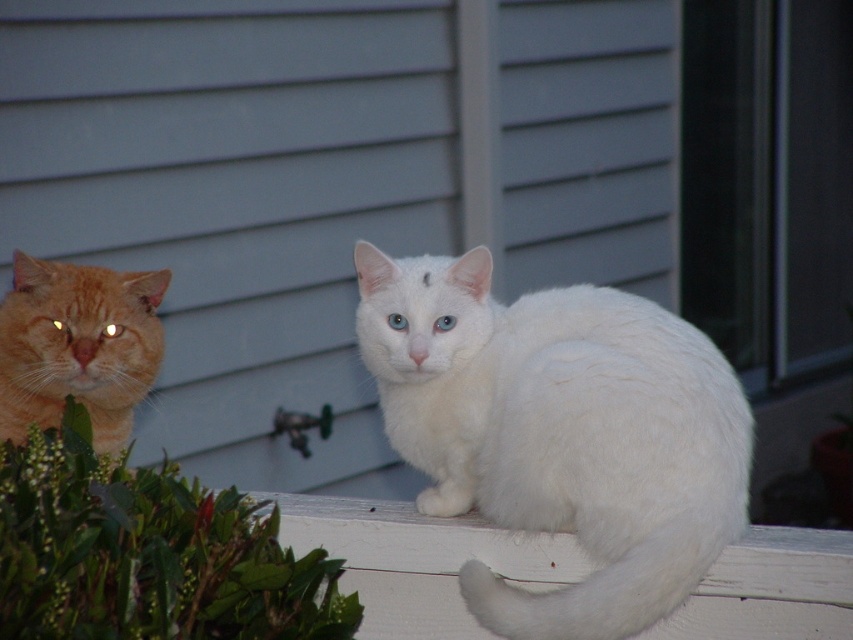
Question: Observing the image, what is the correct spatial positioning of white painted wood at lower center in reference to orange fur cat at left?

Choices:
 (A) above
 (B) below

Answer: (B)

Question: Is white painted wood at lower center above orange fur cat at left?

Choices:
 (A) yes
 (B) no

Answer: (B)

Question: In this image, where is white painted wood at lower center located relative to orange fur cat at left?

Choices:
 (A) below
 (B) above

Answer: (A)

Question: Among these points, which one is farthest from the camera?

Choices:
 (A) (708, 595)
 (B) (692, 547)

Answer: (A)

Question: Which point is closer to the camera?

Choices:
 (A) (660, 316)
 (B) (753, 602)

Answer: (B)

Question: Which is nearer to the orange fur cat at left?

Choices:
 (A) white fluffy cat at center
 (B) white painted wood at lower center

Answer: (B)